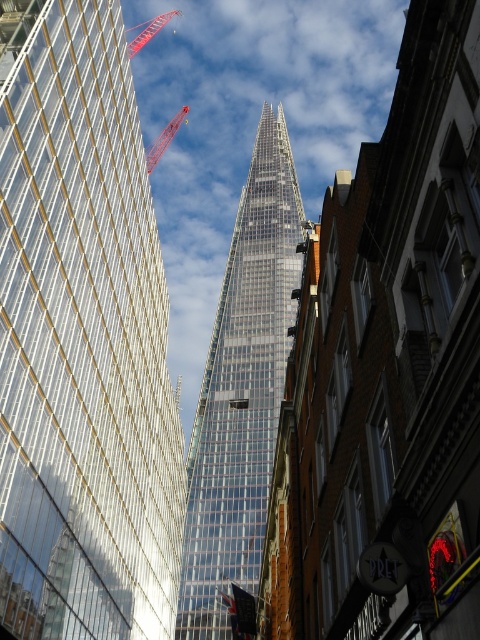
From the picture: You are an architect analyzing the urban layout. Given the transparent glass skyscraper at center and the metallic red crane at upper center, which object occupies a wider horizontal space in the image?

The metallic red crane at upper center is wider than the transparent glass skyscraper at center.

You are standing in the city square and see both the transparent glass skyscraper at center and the transparent glass tower at center. Which one appears nearer to you?

The transparent glass skyscraper at center appears closer to you than the transparent glass tower at center because it is positioned nearer in the scene.